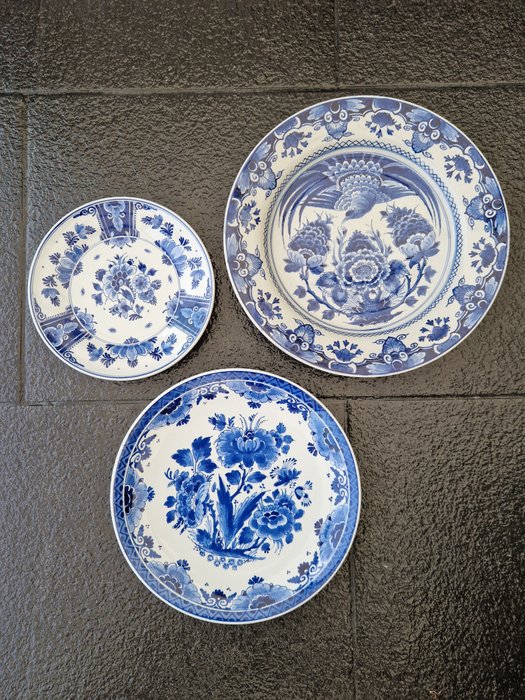
This screenshot has width=525, height=700. What are the coordinates of `3 ceramic` in the screenshot? It's located at (362, 284).